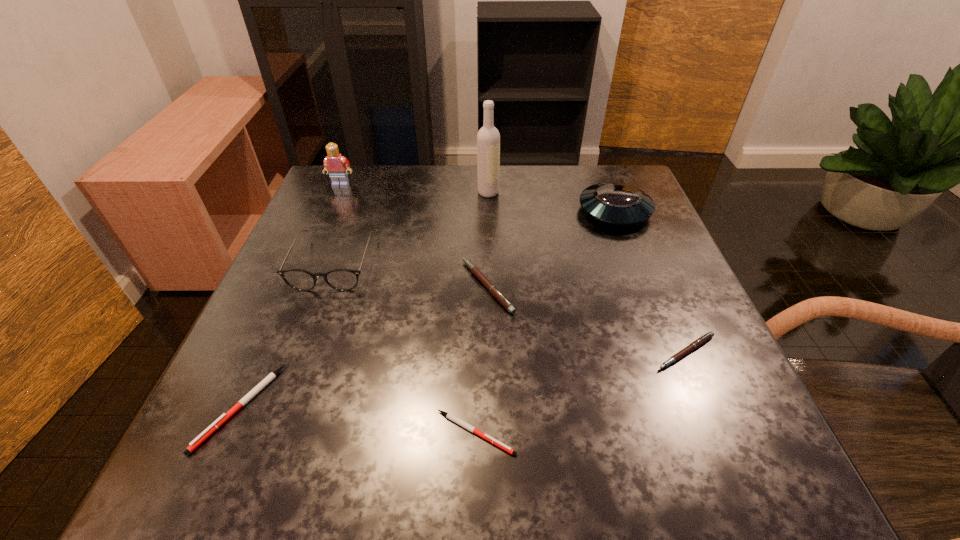
Identify which pen is the closest to the saucer. Please provide its 2D coordinates. Your answer should be formatted as a tuple, i.e. [(x, y)], where the tuple contains the x and y coordinates of a point satisfying the conditions above.

[(493, 290)]

You are a GUI agent. You are given a task and a screenshot of the screen. Output one action in this format:
    pyautogui.click(x=<x>, y=<y>)
    Task: Click on the pen identified as the second closest to the seventh shortest object
    This screenshot has width=960, height=540.
    Given the screenshot: What is the action you would take?
    pyautogui.click(x=224, y=417)

Locate an element on the screen. vacant space that satisfies the following two spatial constraints: 1. on the front-facing side of the seventh shortest object; 2. on the left side of the white vodka is located at coordinates (338, 192).

Where is `vacant area in the image that satisfies the following two spatial constraints: 1. at the nib of the right pink pen; 2. on the clicker of the shortest pen`? This screenshot has width=960, height=540. vacant area in the image that satisfies the following two spatial constraints: 1. at the nib of the right pink pen; 2. on the clicker of the shortest pen is located at coordinates (720, 433).